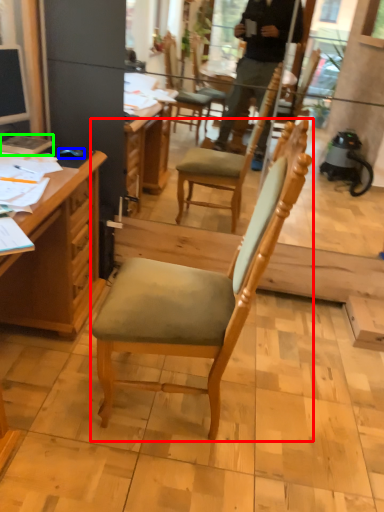
Question: Based on their relative distances, which object is farther from chair (highlighted by a red box)? Choose from computer mouse (highlighted by a blue box) and book (highlighted by a green box).

Choices:
 (A) computer mouse
 (B) book

Answer: (B)